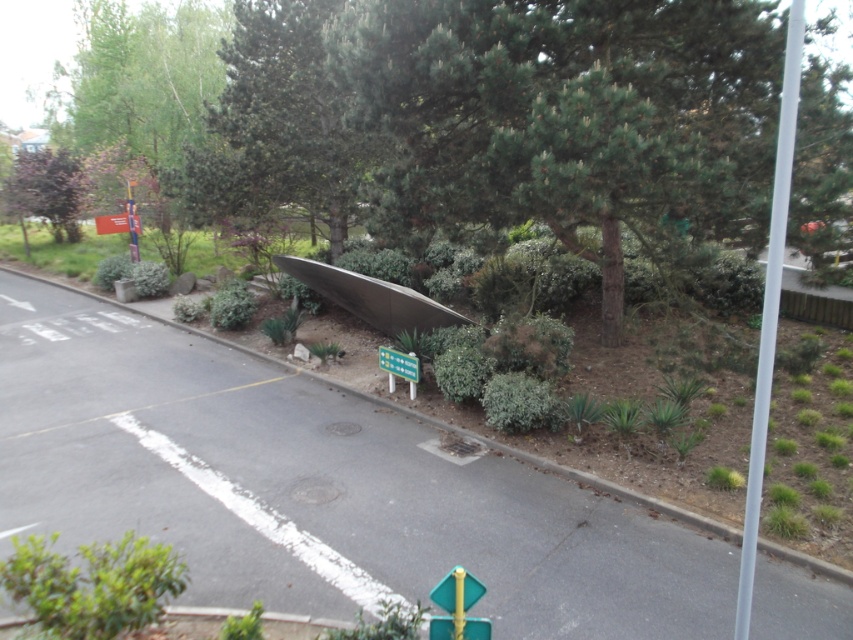
Who is positioned more to the right, green textured tree at upper center or green matte traffic sign at lower center?

green matte traffic sign at lower center

Who is lower down, green textured tree at upper center or green matte traffic sign at lower center?

green matte traffic sign at lower center is lower down.

Does point (210, 156) lie behind point (431, 632)?

Yes, it is.

Find the location of `green textured tree at upper center`. green textured tree at upper center is located at coordinates (277, 124).

Does green textured tree at upper center have a greater height compared to green leafy bush at lower left?

Yes.

The image size is (853, 640). What do you see at coordinates (277, 124) in the screenshot?
I see `green textured tree at upper center` at bounding box center [277, 124].

Between point (258, 35) and point (126, 545), which one is positioned behind?

Point (258, 35)

The width and height of the screenshot is (853, 640). I want to click on green textured tree at upper center, so click(x=277, y=124).

Is green textured tree at center above metallic rectangular sign at upper left?

No, green textured tree at center is not above metallic rectangular sign at upper left.

Based on the photo, who is more distant from viewer, [395,195] or [126,198]?

Point [126,198]

This screenshot has height=640, width=853. In order to click on green textured tree at center in this screenshot , I will do `click(567, 118)`.